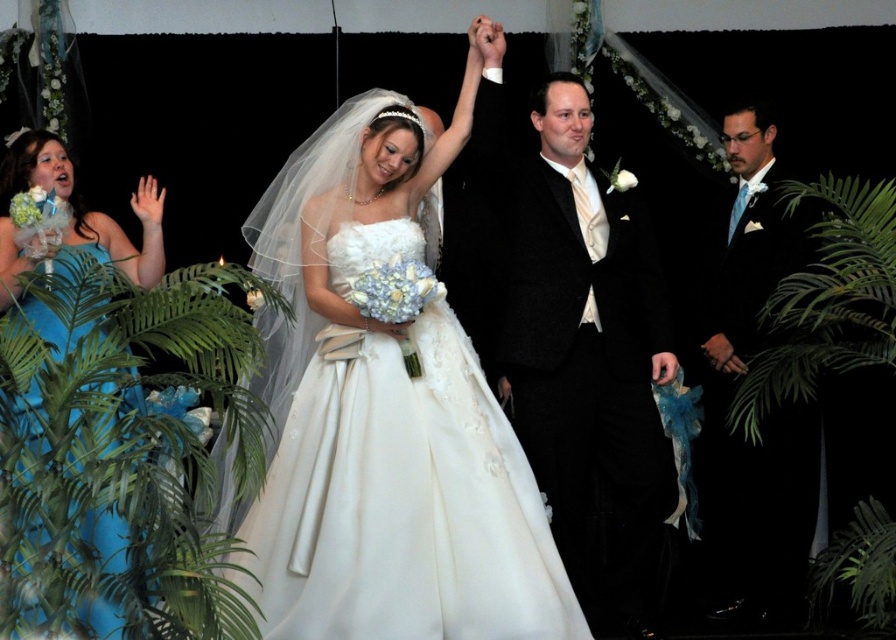
Is point (738, 225) positioned before point (13, 156)?

No, (738, 225) is behind (13, 156).

Is shiny black suit at center below teal satin dress at left?

Correct, shiny black suit at center is located below teal satin dress at left.

Which is in front, point (795, 534) or point (49, 164)?

Point (49, 164)

The height and width of the screenshot is (640, 896). Identify the location of shiny black suit at center. (738, 381).

Which is below, satin/smooth dress at center or shiny black suit at center?

satin/smooth dress at center is below.

Is point (378, 337) farther from camera compared to point (784, 449)?

No.

Describe the element at coordinates (402, 502) in the screenshot. I see `satin/smooth dress at center` at that location.

The height and width of the screenshot is (640, 896). I want to click on satin/smooth dress at center, so click(x=402, y=502).

Is point (373, 554) closer to viewer compared to point (116, 612)?

No, (373, 554) is behind (116, 612).

Is satin/smooth dress at center to the right of teal satin dress at left from the viewer's perspective?

Indeed, satin/smooth dress at center is positioned on the right side of teal satin dress at left.

Which is in front, point (522, 580) or point (156, 252)?

Positioned in front is point (522, 580).

Locate an element on the screen. The height and width of the screenshot is (640, 896). satin/smooth dress at center is located at coordinates (402, 502).